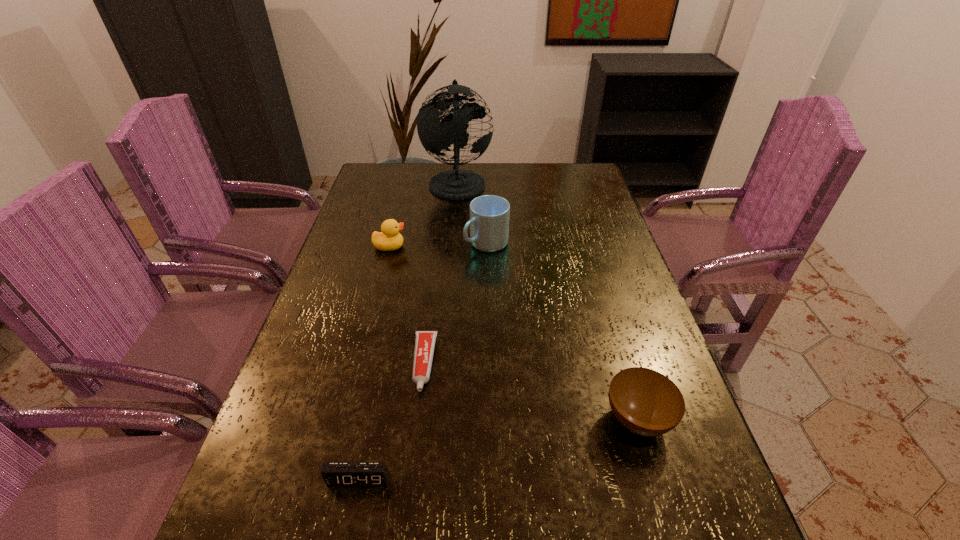
The height and width of the screenshot is (540, 960). I want to click on free space between the rightmost object and the globe, so click(x=547, y=301).

At what (x,y) coordinates should I click in order to perform the action: click on blank region between the duck and the toothpaste. Please return your answer as a coordinate pair (x, y). Looking at the image, I should click on (407, 305).

At what (x,y) coordinates should I click in order to perform the action: click on unoccupied position between the nearest object and the duck. Please return your answer as a coordinate pair (x, y). The height and width of the screenshot is (540, 960). Looking at the image, I should click on (374, 363).

Identify the location of object that is the closest one to the fourth tallest object. This screenshot has height=540, width=960. (425, 340).

Where is `the fourth closest object to the tallest object`? This screenshot has height=540, width=960. the fourth closest object to the tallest object is located at coordinates (647, 403).

This screenshot has width=960, height=540. I want to click on vacant space that satisfies the following two spatial constraints: 1. on the front side of the second tallest object; 2. at the beak of the duck, so click(x=487, y=246).

Locate an element on the screen. vacant area in the image that satisfies the following two spatial constraints: 1. on the front-facing side of the tallest object; 2. on the back side of the bowl is located at coordinates (439, 420).

You are a GUI agent. You are given a task and a screenshot of the screen. Output one action in this format:
    pyautogui.click(x=<x>, y=<y>)
    Task: Click on the vacant region that satisfies the following two spatial constraints: 1. on the front-facing side of the tallest object; 2. at the nozzle of the shortest object
    
    Given the screenshot: What is the action you would take?
    pyautogui.click(x=444, y=363)

Find the location of a particular element. free space that satisfies the following two spatial constraints: 1. on the front-facing side of the tallest object; 2. on the right side of the mug is located at coordinates (453, 243).

Identify the location of free space that satisfies the following two spatial constraints: 1. on the front-facing side of the globe; 2. on the right side of the bowl. (439, 420).